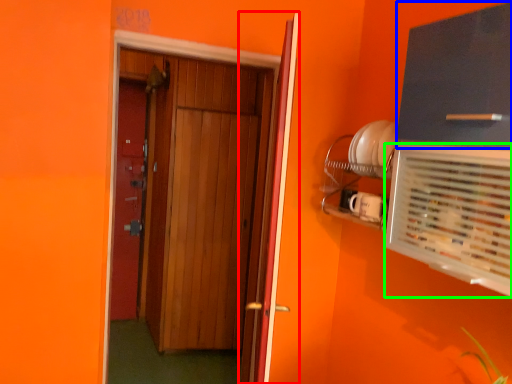
Question: Which object is the closest to the door (highlighted by a red box)? Choose among these: cabinetry (highlighted by a blue box) or air conditioning (highlighted by a green box).

Choices:
 (A) cabinetry
 (B) air conditioning

Answer: (B)